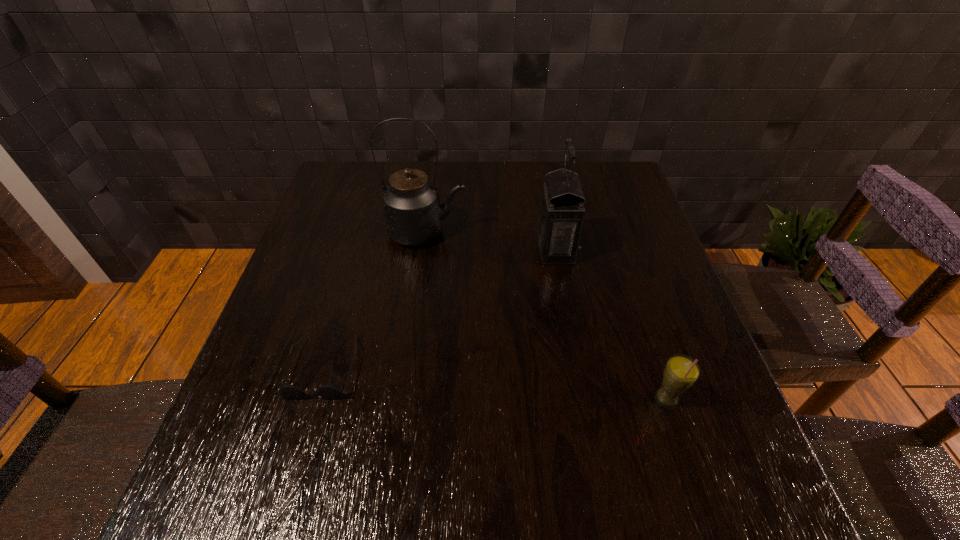
Find the location of `vacant space that satisfies the following two spatial constraints: 1. on the front-facing side of the second object from right to left; 2. on the left side of the straw for drinking`. vacant space that satisfies the following two spatial constraints: 1. on the front-facing side of the second object from right to left; 2. on the left side of the straw for drinking is located at coordinates (583, 399).

You are a GUI agent. You are given a task and a screenshot of the screen. Output one action in this format:
    pyautogui.click(x=<x>, y=<y>)
    Task: Click on the vacant space that satisfies the following two spatial constraints: 1. on the front-facing side of the lantern; 2. on the front-facing side of the shortest object
    The width and height of the screenshot is (960, 540).
    Given the screenshot: What is the action you would take?
    pyautogui.click(x=577, y=367)

This screenshot has height=540, width=960. In order to click on free space that satisfies the following two spatial constraints: 1. on the front-facing side of the second shortest object; 2. on the left side of the second object from right to left in this screenshot , I will do point(583,399).

Identify the location of vacant region that satisfies the following two spatial constraints: 1. on the back side of the third tallest object; 2. spout on the kettle. The width and height of the screenshot is (960, 540). (612, 233).

Find the location of `vacant area that satisfies the following two spatial constraints: 1. spout on the second shortest object; 2. on the left side of the kettle`. vacant area that satisfies the following two spatial constraints: 1. spout on the second shortest object; 2. on the left side of the kettle is located at coordinates (404, 399).

This screenshot has width=960, height=540. Find the location of `free space that satisfies the following two spatial constraints: 1. on the front-facing side of the lantern; 2. on the front-facing side of the shortest object`. free space that satisfies the following two spatial constraints: 1. on the front-facing side of the lantern; 2. on the front-facing side of the shortest object is located at coordinates (577, 367).

The height and width of the screenshot is (540, 960). What are the coordinates of `vacant point that satisfies the following two spatial constraints: 1. on the front-facing side of the second shortest object; 2. on the left side of the lantern` in the screenshot? It's located at (583, 399).

Image resolution: width=960 pixels, height=540 pixels. I want to click on vacant space that satisfies the following two spatial constraints: 1. on the front-facing side of the straw for drinking; 2. on the right side of the lantern, so click(583, 399).

Locate an element on the screen. vacant space that satisfies the following two spatial constraints: 1. on the front-facing side of the lantern; 2. on the front-facing side of the shortest object is located at coordinates (577, 367).

This screenshot has width=960, height=540. Find the location of `free point that satisfies the following two spatial constraints: 1. on the front-facing side of the sunglasses; 2. on the right side of the straw for drinking`. free point that satisfies the following two spatial constraints: 1. on the front-facing side of the sunglasses; 2. on the right side of the straw for drinking is located at coordinates (314, 399).